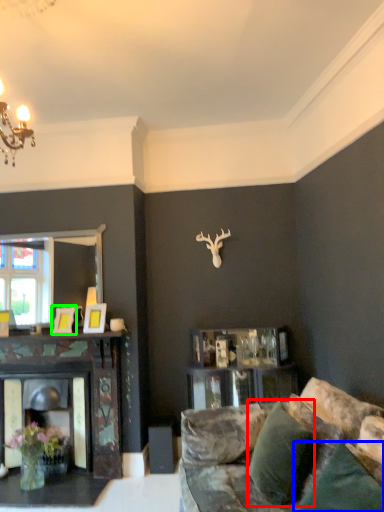
Question: Based on their relative distances, which object is farther from pillow (highlighted by a red box)? Choose from pillow (highlighted by a blue box) and picture frame (highlighted by a green box).

Choices:
 (A) pillow
 (B) picture frame

Answer: (B)